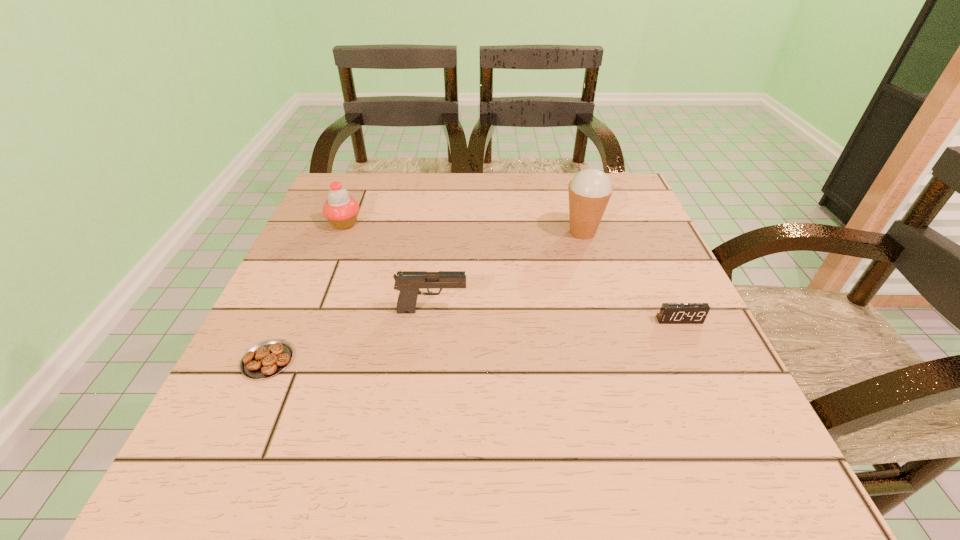
The image size is (960, 540). I want to click on free spot located 0.090m on the front of the cupcake, so click(x=330, y=258).

Find the location of `vacant space situated aim along the barrel of the third object from left to right`. vacant space situated aim along the barrel of the third object from left to right is located at coordinates (593, 310).

The height and width of the screenshot is (540, 960). What are the coordinates of `free point located 0.220m on the front-facing side of the alarm clock` in the screenshot? It's located at (732, 434).

The image size is (960, 540). I want to click on free spot located on the back of the nearest object, so click(328, 226).

Find the location of `icecream positioned at the far edge`. icecream positioned at the far edge is located at coordinates (590, 189).

Locate an element on the screen. The width and height of the screenshot is (960, 540). cupcake located in the far edge section of the desktop is located at coordinates (341, 210).

The width and height of the screenshot is (960, 540). I want to click on cupcake at the left edge, so click(x=341, y=210).

Where is `pastry present at the left edge`? The image size is (960, 540). pastry present at the left edge is located at coordinates (268, 358).

Find the location of a particular element. The width and height of the screenshot is (960, 540). icecream positioned at the right edge is located at coordinates (590, 189).

The width and height of the screenshot is (960, 540). In order to click on alarm clock at the right edge in this screenshot , I will do `click(670, 313)`.